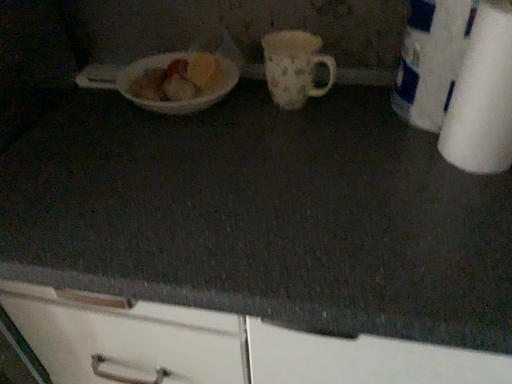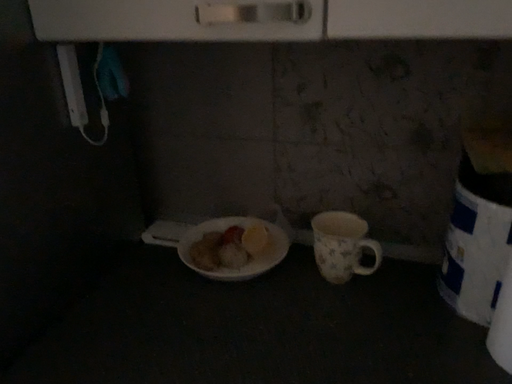
Question: How did the camera likely rotate when shooting the video?

Choices:
 (A) rotated upward
 (B) rotated downward

Answer: (A)